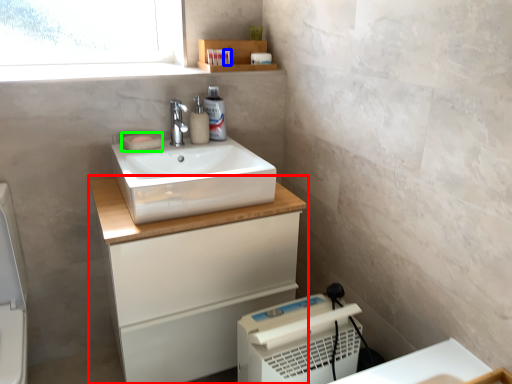
Question: Which is farther away from bathroom cabinet (highlighted by a red box)? toiletry (highlighted by a blue box) or soap (highlighted by a green box)?

Choices:
 (A) toiletry
 (B) soap

Answer: (A)